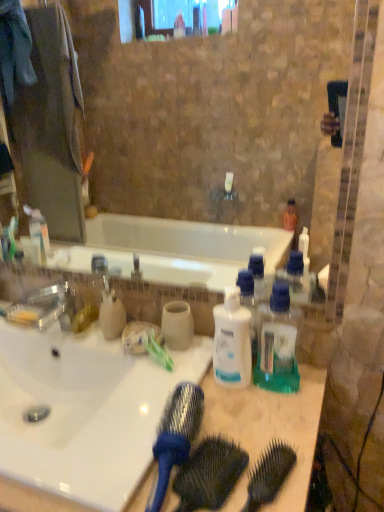
Identify the location of vacant area on the back side of blue plastic brush at center, which appears as the 1th brush when viewed from the left. The width and height of the screenshot is (384, 512). (201, 400).